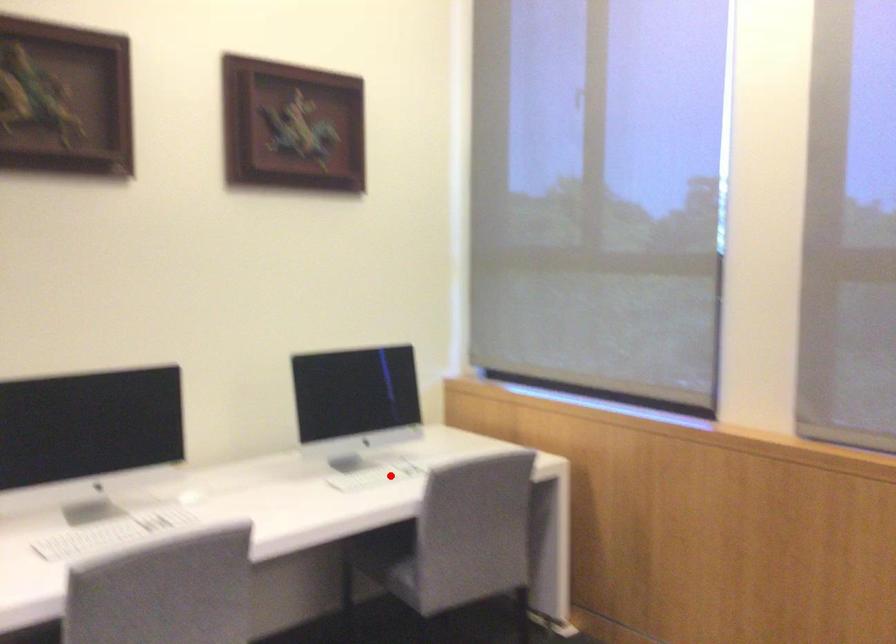
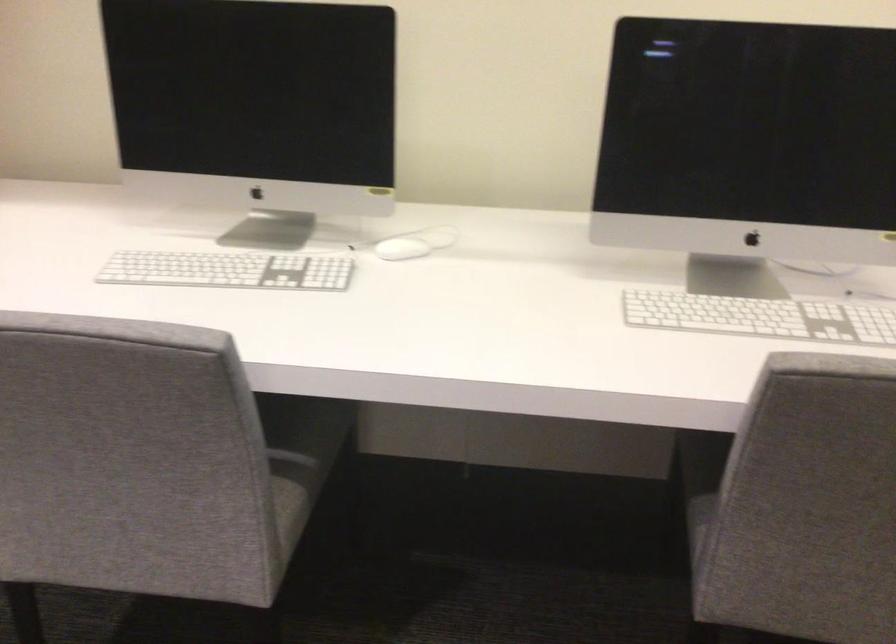
Where in the second image is the point corresponding to the highlighted location from the first image?

(760, 317)